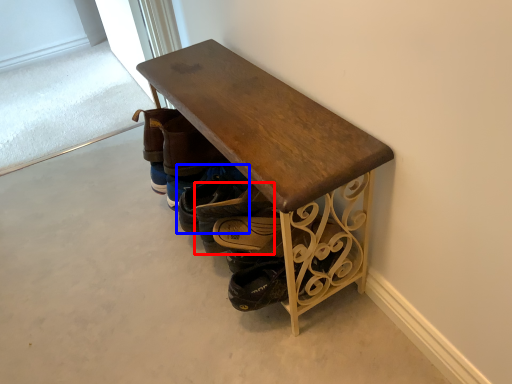
Question: Which object is further to the camera taking this photo, footwear (highlighted by a red box) or footwear (highlighted by a blue box)?

Choices:
 (A) footwear
 (B) footwear

Answer: (B)